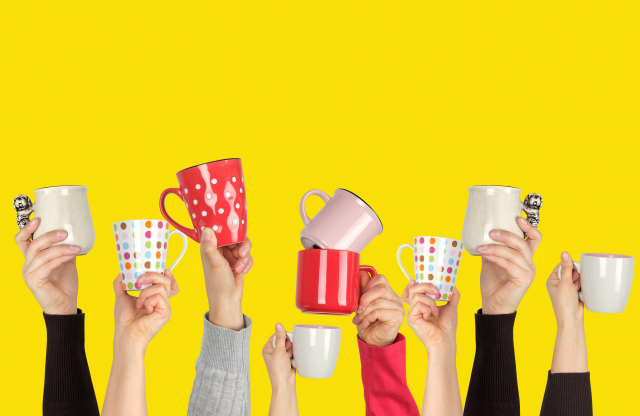
I want to click on cup, so click(68, 216), click(144, 234), click(220, 202), click(313, 350), click(319, 277), click(340, 209), click(441, 260), click(492, 200), click(605, 298).